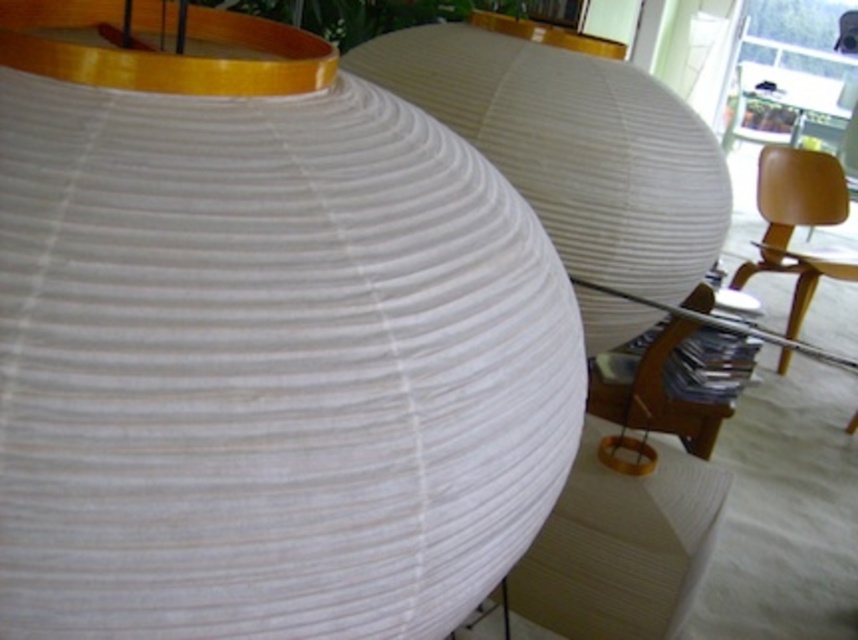
Locate an element on the screen. The width and height of the screenshot is (858, 640). white paper lantern at center is located at coordinates (260, 342).

Does white paper lantern at center lie in front of white ribbed paper lantern at center?

Yes, white paper lantern at center is closer to the viewer.

Is point (345, 403) closer to viewer compared to point (533, 83)?

Yes, it is.

The image size is (858, 640). I want to click on white paper lantern at center, so click(260, 342).

Does white ribbed paper lantern at center have a lesser width compared to white paper table at lower right?

In fact, white ribbed paper lantern at center might be wider than white paper table at lower right.

Does point (623, 198) come farther from viewer compared to point (611, 515)?

No.

Locate an element on the screen. The image size is (858, 640). white ribbed paper lantern at center is located at coordinates coord(573,147).

Where is `white ribbed paper lantern at center`? This screenshot has height=640, width=858. white ribbed paper lantern at center is located at coordinates (573, 147).

Can you confirm if white paper lantern at center is bigger than matte yellow chair at right?

No.

Does white paper lantern at center appear on the left side of matte yellow chair at right?

Correct, you'll find white paper lantern at center to the left of matte yellow chair at right.

Between point (242, 211) and point (771, 150), which one is positioned behind?

The point (771, 150) is behind.

Locate an element on the screen. The height and width of the screenshot is (640, 858). white paper lantern at center is located at coordinates (260, 342).